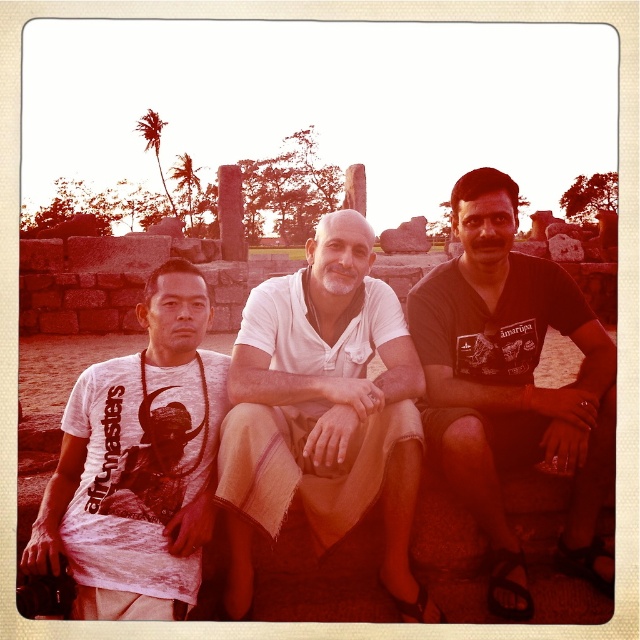
Question: Which object is the farthest from the dark brown cotton t-shirt at center?

Choices:
 (A) white cotton shirt at center
 (B) white cotton t-shirt at left

Answer: (B)

Question: Is white cotton shirt at center above dark brown cotton t-shirt at center?

Choices:
 (A) yes
 (B) no

Answer: (B)

Question: Estimate the real-world distances between objects in this image. Which object is closer to the white cotton shirt at center?

Choices:
 (A) dark brown cotton t-shirt at center
 (B) white cotton t-shirt at left

Answer: (B)

Question: Can you confirm if dark brown cotton t-shirt at center is smaller than white cotton t-shirt at left?

Choices:
 (A) no
 (B) yes

Answer: (A)

Question: Which of the following is the closest to the observer?

Choices:
 (A) white cotton shirt at center
 (B) white cotton t-shirt at left

Answer: (B)

Question: Is dark brown cotton t-shirt at center thinner than white cotton t-shirt at left?

Choices:
 (A) no
 (B) yes

Answer: (A)